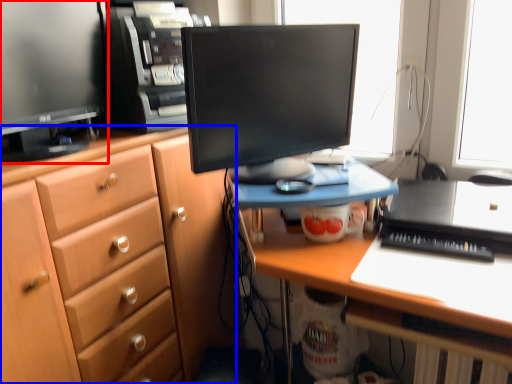
Question: Which of the following is the closest to the observer, computer monitor (highlighted by a red box) or cabinetry (highlighted by a blue box)?

Choices:
 (A) computer monitor
 (B) cabinetry

Answer: (B)